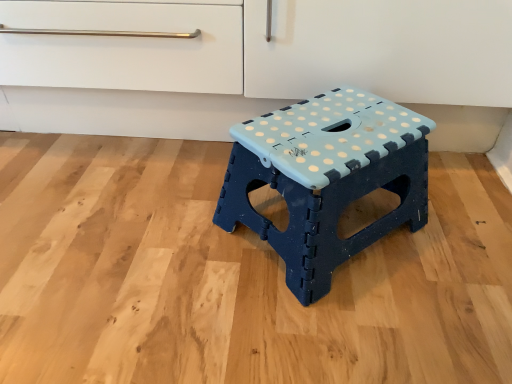
Find the location of a particular element. This screenshot has height=384, width=512. free space above blue textured stool at center (from a real-world perspective) is located at coordinates (329, 132).